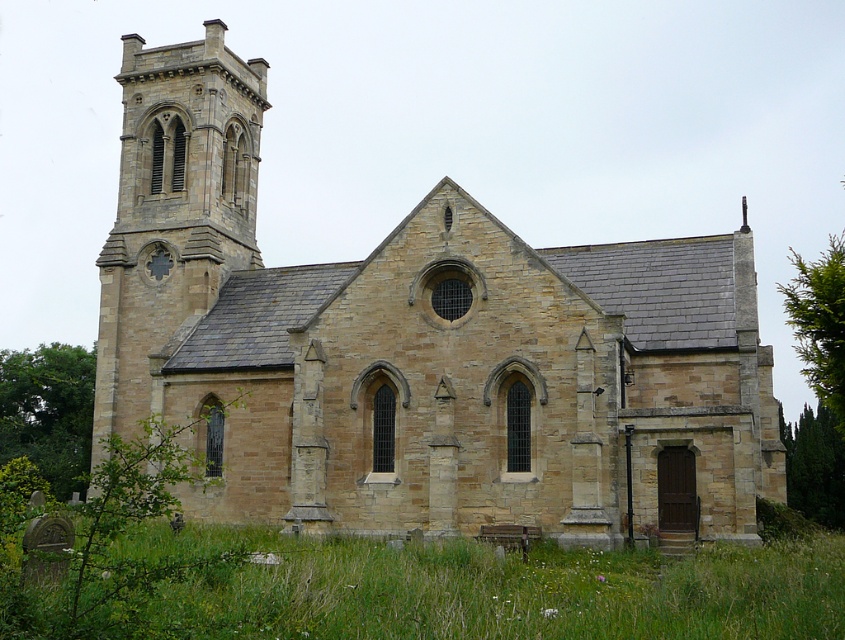
Question: Among these objects, which one is nearest to the camera?

Choices:
 (A) beige stone church at center
 (B) green grass at lower center

Answer: (B)

Question: Which point is farther to the camera?

Choices:
 (A) (440, 588)
 (B) (500, 454)

Answer: (B)

Question: Can you confirm if beige stone church at center is wider than green grass at lower center?

Choices:
 (A) yes
 (B) no

Answer: (A)

Question: Is beige stone church at center smaller than green grass at lower center?

Choices:
 (A) no
 (B) yes

Answer: (A)

Question: Observing the image, what is the correct spatial positioning of beige stone church at center in reference to green grass at lower center?

Choices:
 (A) right
 (B) left

Answer: (A)